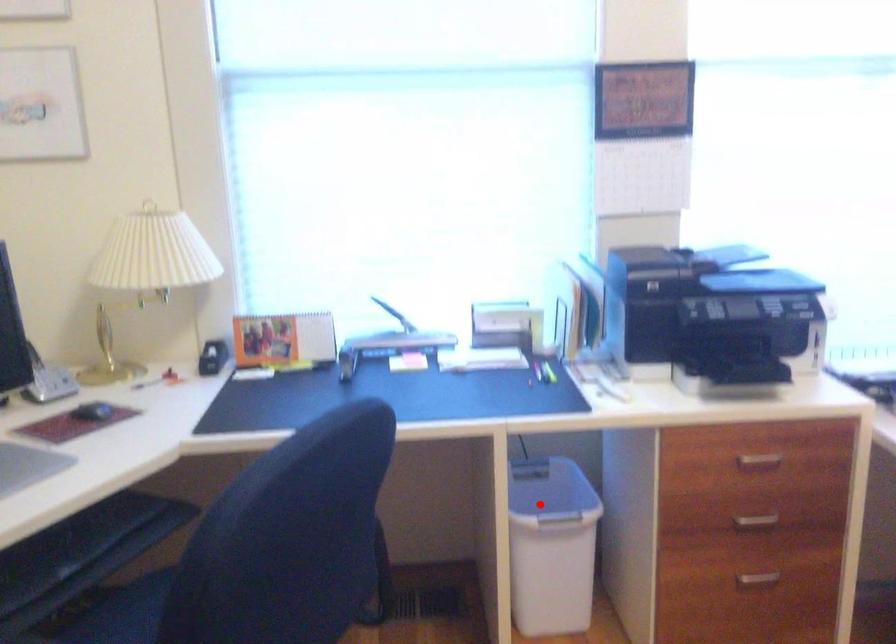
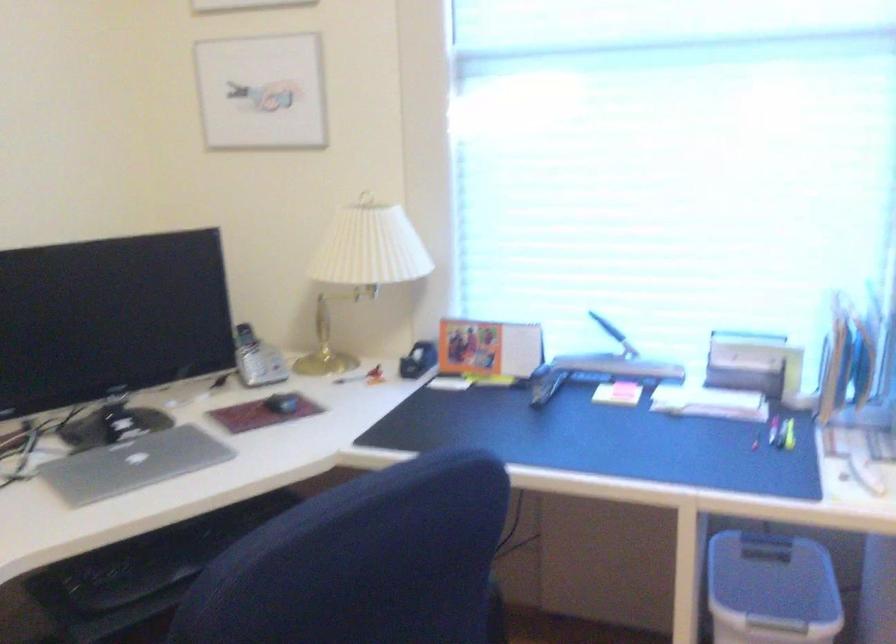
Find the pixel in the second image that matches the highlighted location in the first image.

(771, 589)